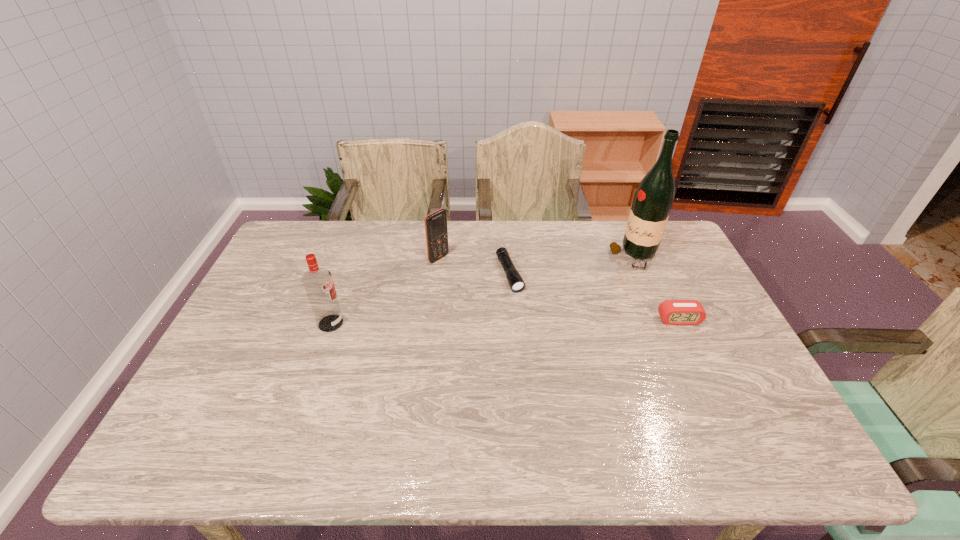
Find the location of a particular element. cellular telephone at the far edge is located at coordinates (436, 230).

Locate an element on the screen. This screenshot has width=960, height=540. flashlight situated at the far edge is located at coordinates (517, 284).

The height and width of the screenshot is (540, 960). What are the coordinates of `alarm clock that is at the right edge` in the screenshot? It's located at (672, 312).

Where is `wine bottle situated at the right edge`? wine bottle situated at the right edge is located at coordinates (654, 197).

The height and width of the screenshot is (540, 960). Identify the location of object at the far right corner. (654, 197).

I want to click on free space at the far edge of the desktop, so click(x=383, y=240).

Find the location of a particular element. The image size is (960, 540). free space at the near edge of the desktop is located at coordinates (363, 418).

Locate an element on the screen. free space at the left edge of the desktop is located at coordinates (226, 387).

Image resolution: width=960 pixels, height=540 pixels. In the image, there is a desktop. Find the location of `vacant space at the far left corner`. vacant space at the far left corner is located at coordinates (312, 251).

This screenshot has height=540, width=960. I want to click on free spot between the leftmost object and the cellular telephone, so click(385, 291).